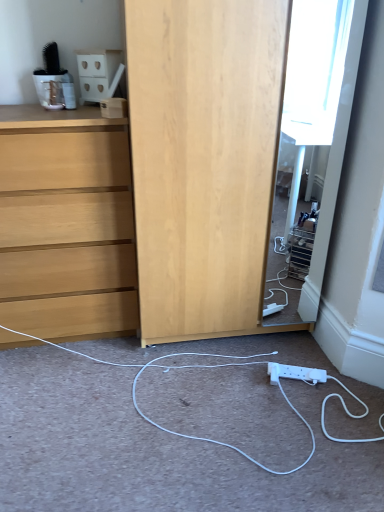
Locate an element on the screen. Image resolution: width=384 pixels, height=512 pixels. free spot above white plastic power strip at lower center (from a real-world perspective) is located at coordinates (220, 386).